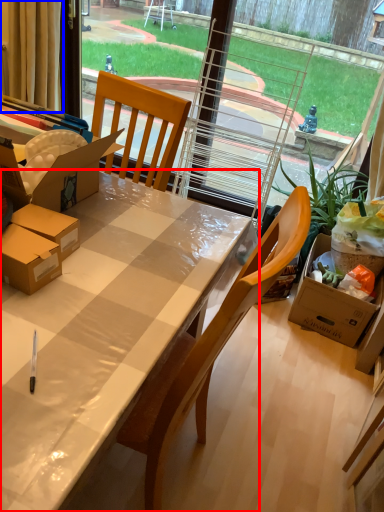
Question: Among these objects, which one is farthest to the camera, desk (highlighted by a red box) or curtain (highlighted by a blue box)?

Choices:
 (A) desk
 (B) curtain

Answer: (B)